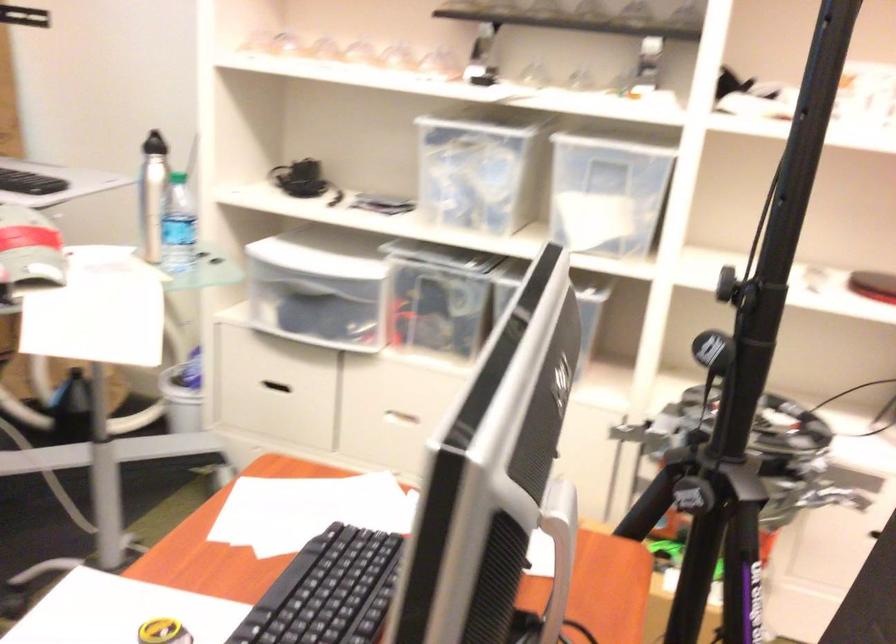
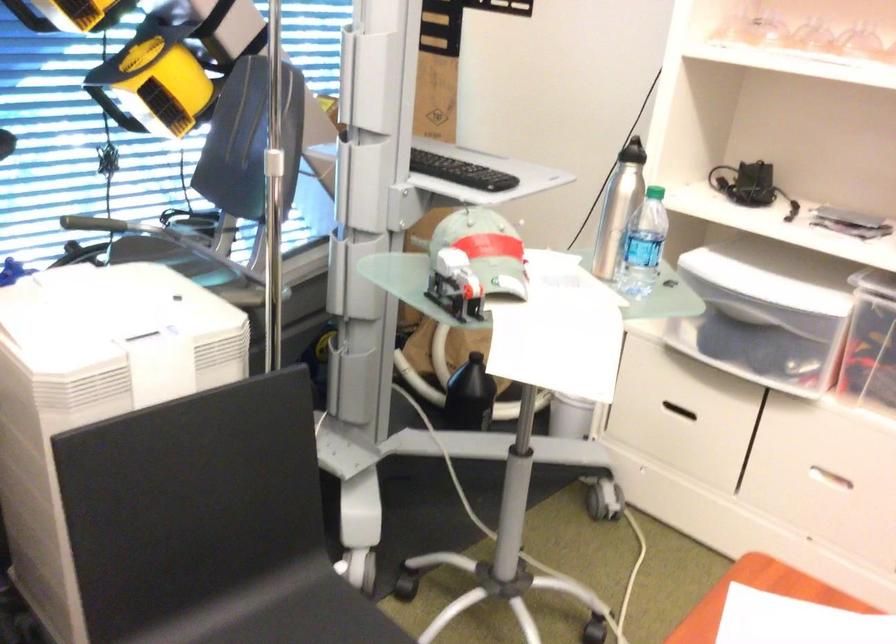
The point at (179, 228) is marked in the first image. Where is the corresponding point in the second image?

(643, 245)